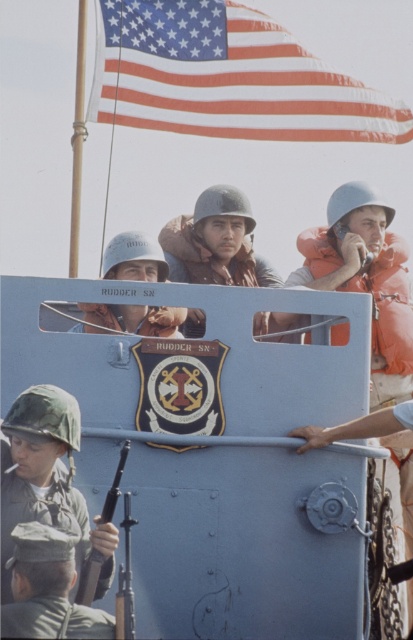
You are a member of the crew on the naval vessel and need to locate the camouflage fabric helmet at lower left. According to the coordinates provided, where exactly should you look to find it?

The camouflage fabric helmet at lower left can be found at coordinates point (47, 477).

You are a photographer on the deck of a naval vessel. You notice the american flag at upper left and the camouflage uniform at lower left. Which object is higher up in the scene?

The american flag at upper left is positioned over camouflage uniform at lower left, so it is higher up in the scene.

You are a photographer trying to capture a clear shot of the camouflage fabric helmet at lower left and the camouflage uniform at lower left. Since you want to focus on the helmet, which object should you zoom in on more and why?

You should zoom in on the camouflage fabric helmet at lower left because its width is larger than the camouflage uniform at lower left, making it easier to focus on the helmet.